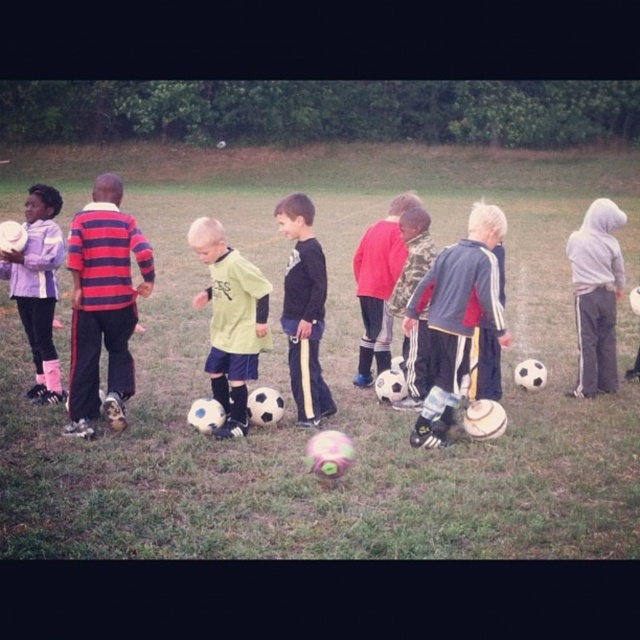
Question: Is white matte soccer ball at center to the right of blue and white striped shirt at center from the viewer's perspective?

Choices:
 (A) yes
 (B) no

Answer: (B)

Question: Which point is farther to the camera?

Choices:
 (A) (177, 305)
 (B) (19, 262)
 (C) (406, 321)

Answer: (A)

Question: Which point is farther from the camera taking this photo?

Choices:
 (A) (324, 342)
 (B) (32, 252)
 (C) (289, 365)

Answer: (A)

Question: Does striped jersey at left appear under camouflage-patterned pants at center?

Choices:
 (A) no
 (B) yes

Answer: (B)

Question: Is the position of light green jersey at center more distant than that of black matte shirt at center?

Choices:
 (A) yes
 (B) no

Answer: (B)

Question: Which of these objects is positioned closest to the black matte shirt at center?

Choices:
 (A) blue and white striped shirt at center
 (B) light green jersey at center
 (C) striped jersey at left
 (D) white matte soccer ball at center

Answer: (B)